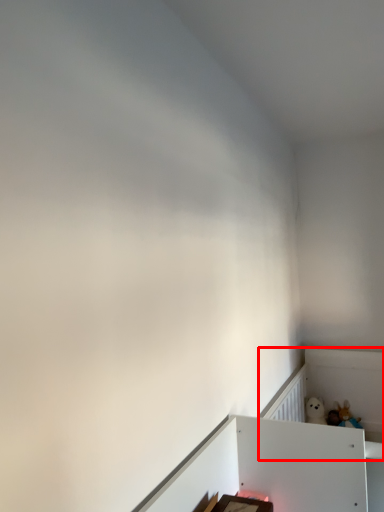
Question: From the image's perspective, considering the relative positions of bed frame (annotated by the red box) and toy in the image provided, where is bed frame (annotated by the red box) located with respect to the staircase?

Choices:
 (A) above
 (B) below

Answer: (B)